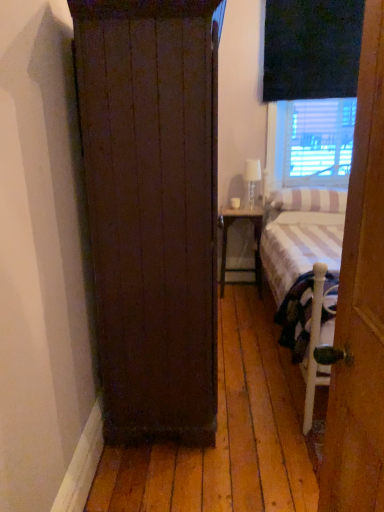
You are a GUI agent. You are given a task and a screenshot of the screen. Output one action in this format:
    pyautogui.click(x=<x>, y=<y>)
    Task: Click on the unoccupied region to the right of dark wood cupboard at left
    
    Given the screenshot: What is the action you would take?
    pyautogui.click(x=258, y=388)